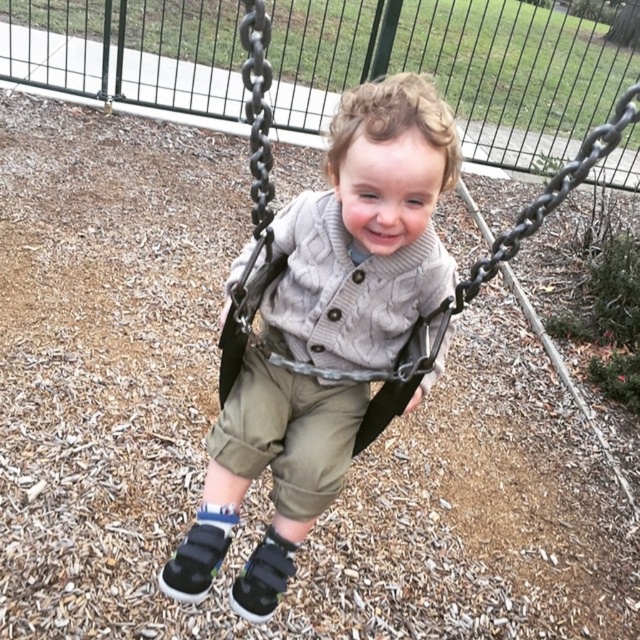
Who is shorter, knitted sweater at center or khaki cotton pants at center?

khaki cotton pants at center

Does point (296, 273) come in front of point (349, 397)?

Yes, point (296, 273) is closer to viewer.

Locate an element on the screen. This screenshot has height=640, width=640. knitted sweater at center is located at coordinates (x=365, y=230).

Is gray fabric swing at center further to camera compared to khaki cotton pants at center?

No, it is not.

Who is lower down, gray fabric swing at center or khaki cotton pants at center?

khaki cotton pants at center

Which is behind, point (419, 346) or point (241, 449)?

The point (419, 346) is more distant.

This screenshot has width=640, height=640. What are the coordinates of `gray fabric swing at center` in the screenshot? It's located at (472, 280).

What do you see at coordinates (365, 230) in the screenshot? This screenshot has height=640, width=640. I see `knitted sweater at center` at bounding box center [365, 230].

Does point (339, 216) come in front of point (248, 314)?

That is True.

Image resolution: width=640 pixels, height=640 pixels. Describe the element at coordinates (365, 230) in the screenshot. I see `knitted sweater at center` at that location.

Locate an element on the screen. The height and width of the screenshot is (640, 640). knitted sweater at center is located at coordinates (365, 230).